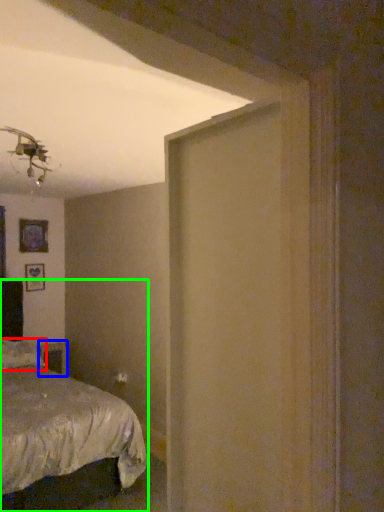
Question: Which is farther away from pillow (highlighted by a red box)? table (highlighted by a blue box) or bed (highlighted by a green box)?

Choices:
 (A) table
 (B) bed

Answer: (A)